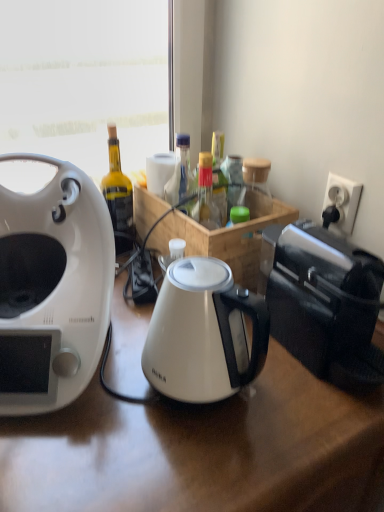
Where is `free point above white glossy electric kettle at center (from a real-world perspective)`? free point above white glossy electric kettle at center (from a real-world perspective) is located at coordinates (197, 291).